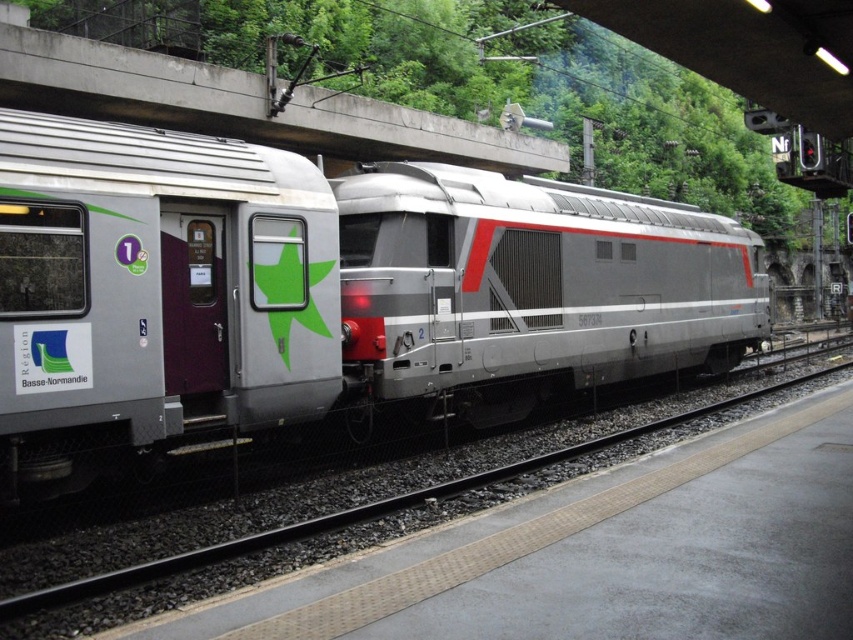
Question: Does silver metallic locomotive at center appear under concrete at upper center?

Choices:
 (A) yes
 (B) no

Answer: (A)

Question: Which object is the farthest from the silver metallic locomotive at center?

Choices:
 (A) concrete at upper center
 (B) metal track at center

Answer: (A)

Question: Which of the following is the closest to the observer?

Choices:
 (A) (221, 428)
 (B) (740, 300)
 (C) (445, 492)

Answer: (A)

Question: Which point is farther from the camera taking this photo?

Choices:
 (A) (537, 387)
 (B) (97, 584)

Answer: (A)

Question: Is silver metallic train car at center to the right of metal track at center from the viewer's perspective?

Choices:
 (A) no
 (B) yes

Answer: (A)

Question: From the image, what is the correct spatial relationship of metal track at center in relation to concrete at upper center?

Choices:
 (A) right
 (B) left

Answer: (A)